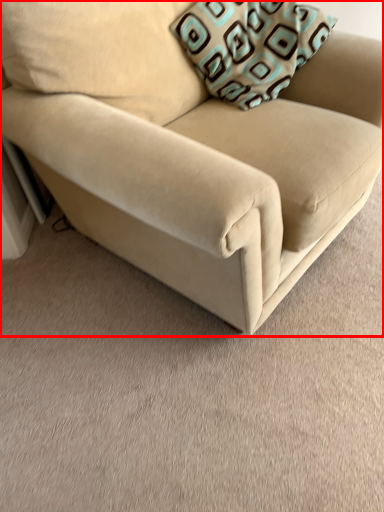
Question: From the image, what is the correct spatial relationship of studio couch (annotated by the red box) in relation to throw pillow?

Choices:
 (A) left
 (B) right

Answer: (A)